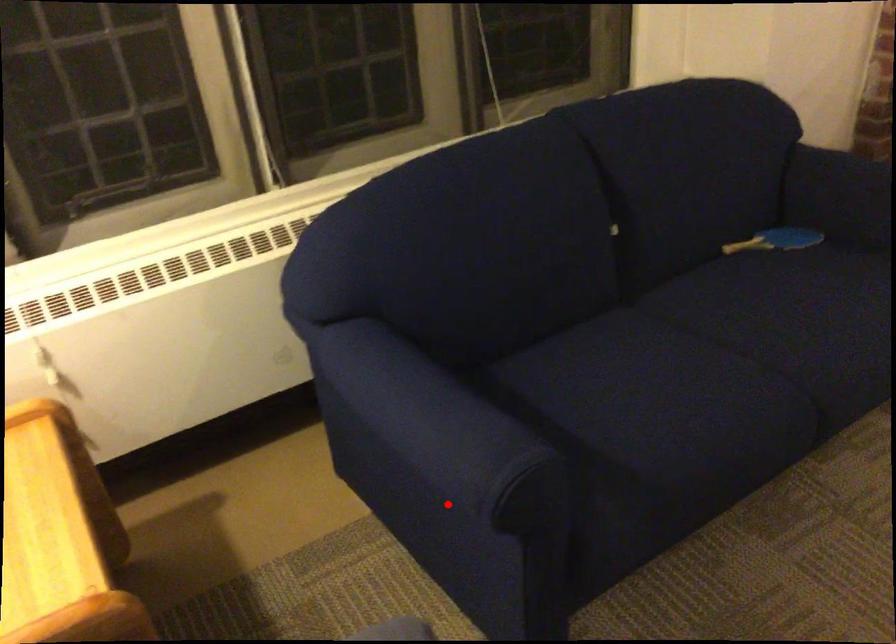
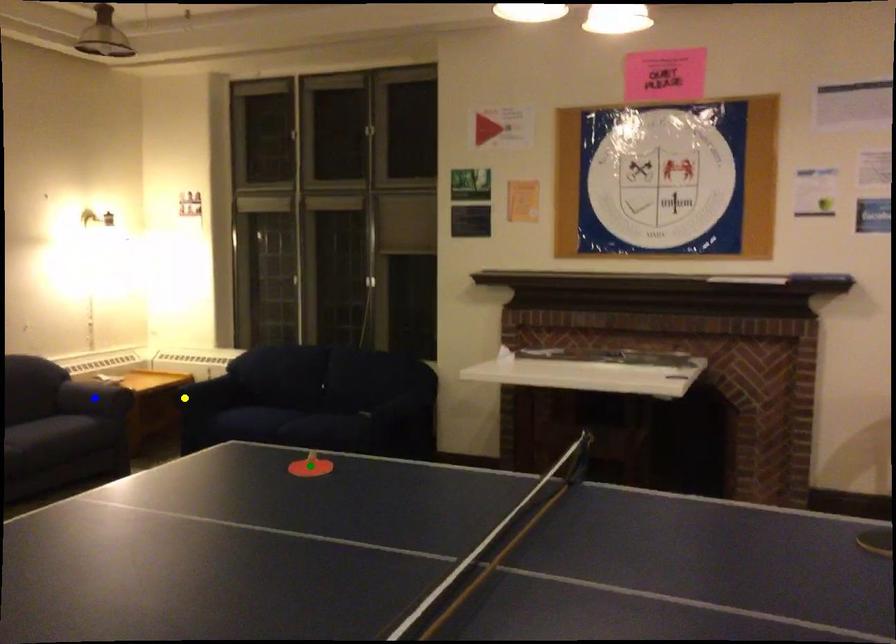
Question: I am providing you with two images of the same scene from different viewpoints. A red point is marked on the first image. You are given multiple points on the second image. In image 2, which mark is for the same physical point as the one in image 1?

Choices:
 (A) green point
 (B) blue point
 (C) yellow point

Answer: (C)